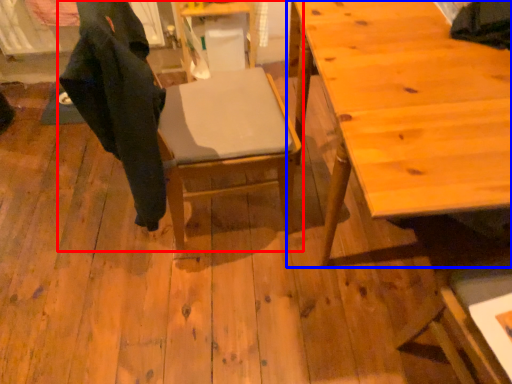
Question: Among these objects, which one is farthest to the camera, chair (highlighted by a red box) or table (highlighted by a blue box)?

Choices:
 (A) chair
 (B) table

Answer: (A)